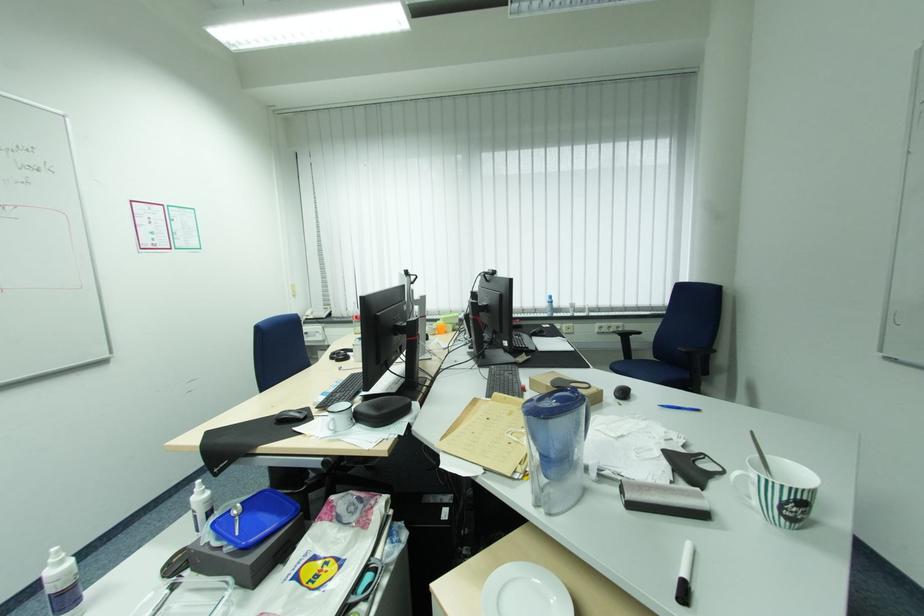
What do you see at coordinates (744, 488) in the screenshot? I see `the striped mug handle` at bounding box center [744, 488].